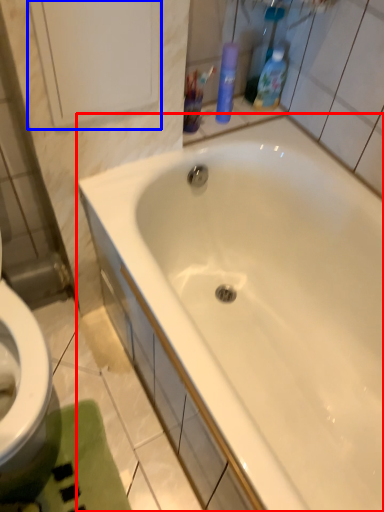
Question: Which of the following is the closest to the observer, bathtub (highlighted by a red box) or medicine cabinet (highlighted by a blue box)?

Choices:
 (A) bathtub
 (B) medicine cabinet

Answer: (A)